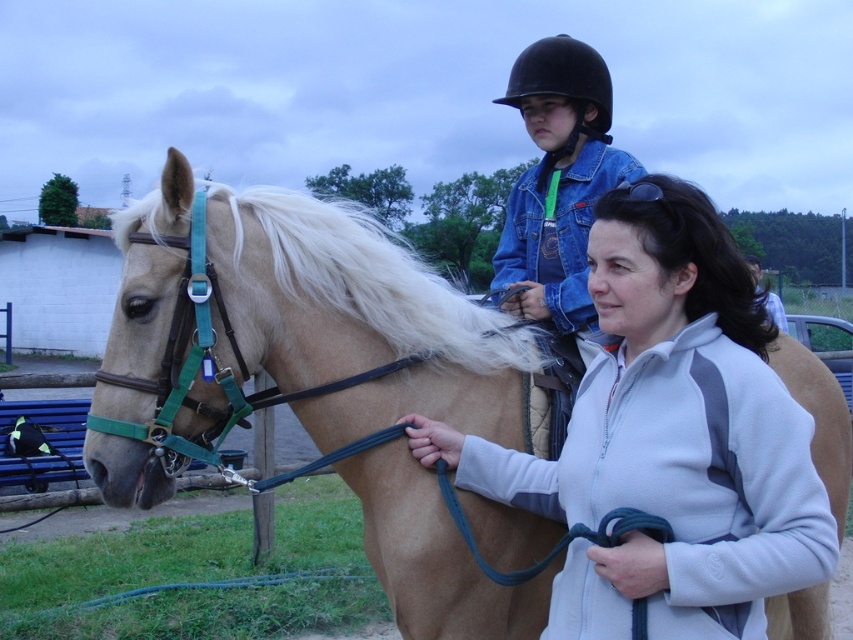
You are a photographer taking a photo of the horse riding scene. You notice two points in the image at coordinates point [158,289] and point [538,90]. Which point is closer to your camera lens?

Point [158,289] is closer to the camera than point [538,90].

You are a photographer positioned at the edge of the scene. You need to capture a photo that includes both the tan leather horse at center and the black matte helmet at upper center. Based on their positions, will the horse appear above or below the helmet in the photo?

The tan leather horse at center is below the black matte helmet at upper center, so in the photo, the horse will appear below the helmet.